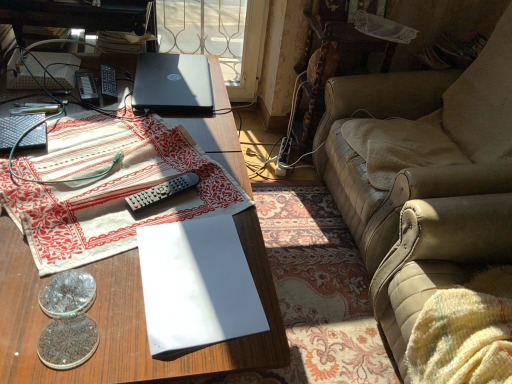
Identify the location of vacant space to the right of white paper at left, the first paperback book from the left. The width and height of the screenshot is (512, 384). (91, 84).